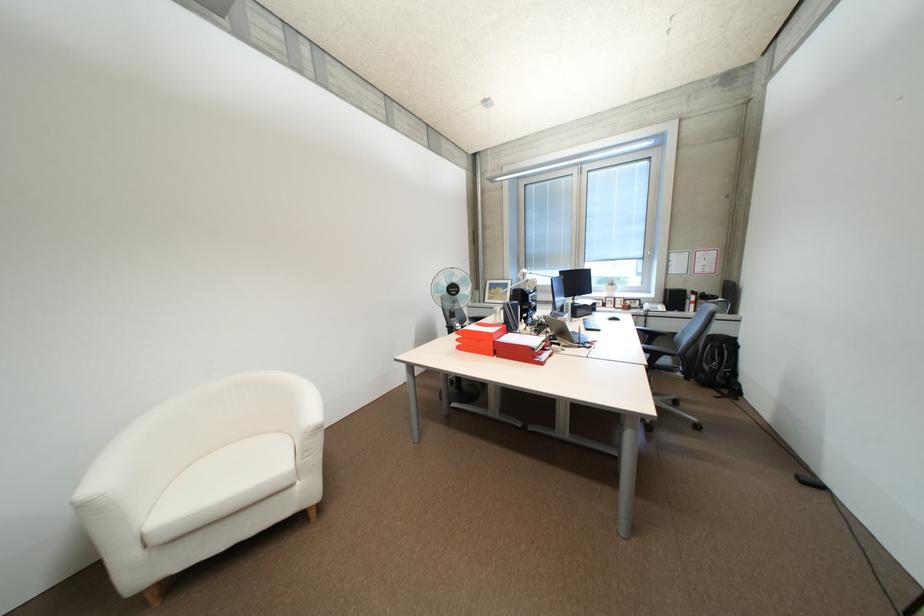
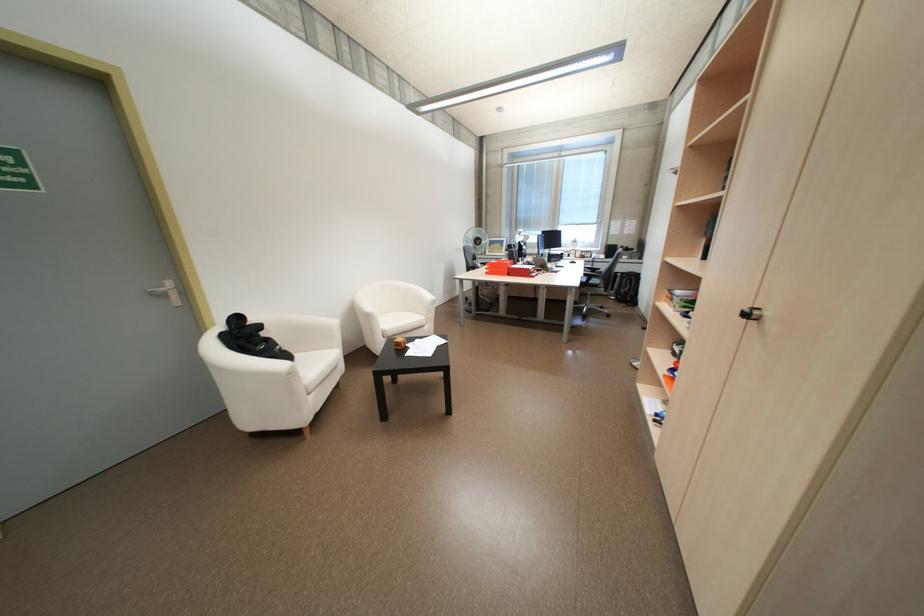
The images are taken continuously from a first-person perspective. In which direction are you moving?

The movement direction of the cameraman is left, backward.